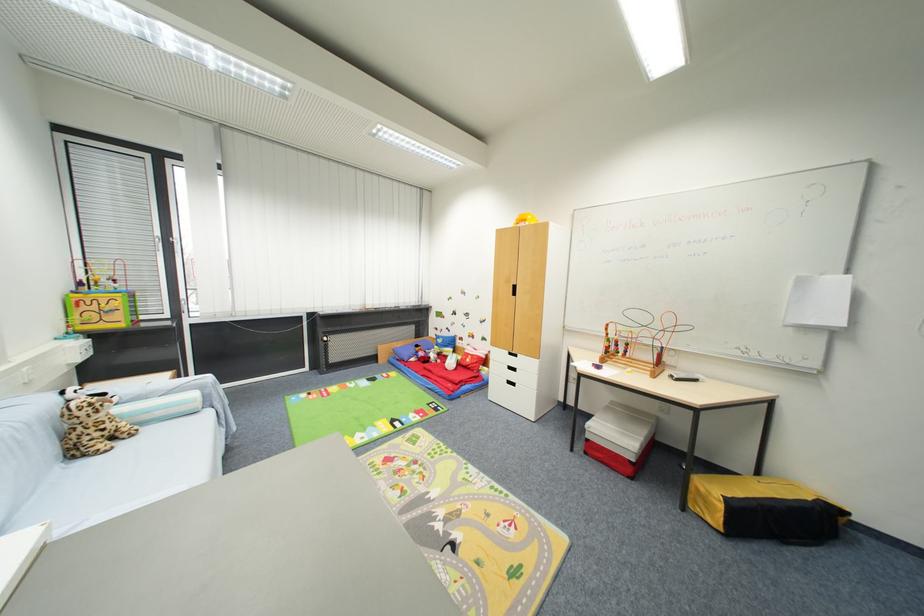
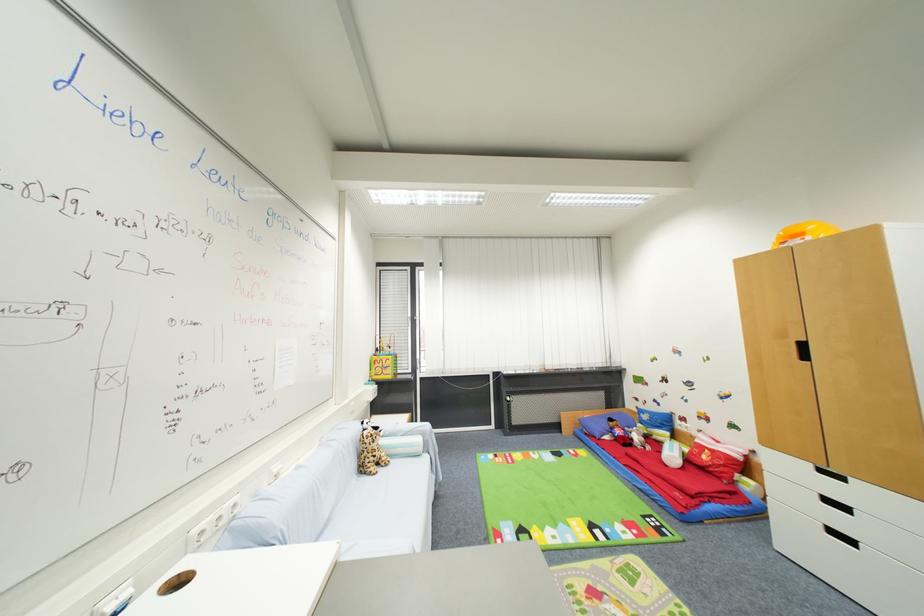
In the second image, find the point that corresponds to (x=519, y=288) in the first image.

(808, 346)